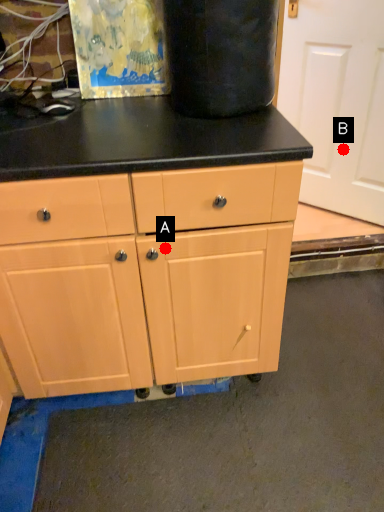
Question: Two points are circled on the image, labeled by A and B beside each circle. Among these points, which one is farthest from the camera?

Choices:
 (A) A is further
 (B) B is further

Answer: (B)